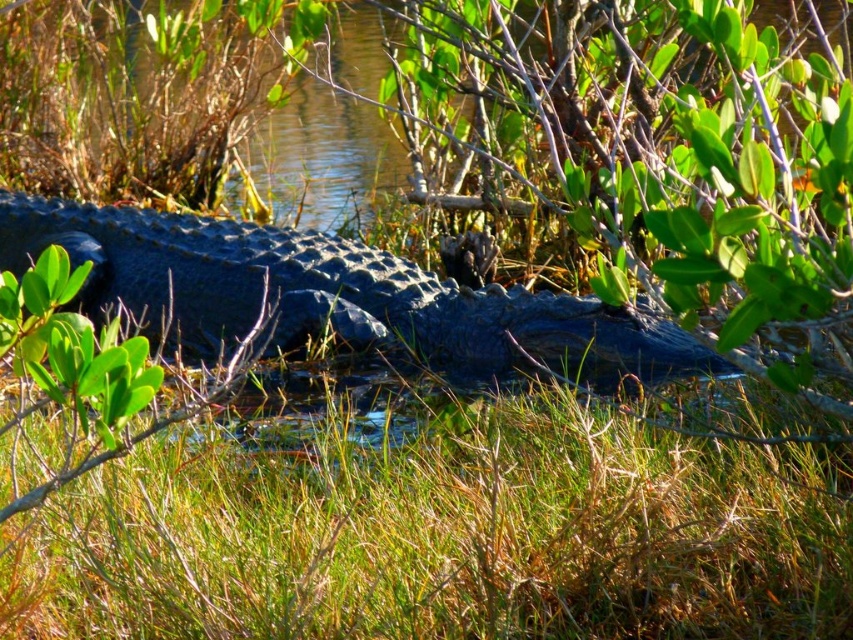
Is green grass at lower center thinner than shiny dark blue crocodile at center?

Yes, green grass at lower center is thinner than shiny dark blue crocodile at center.

Is green grass at lower center wider than shiny dark blue crocodile at center?

Incorrect, green grass at lower center's width does not surpass shiny dark blue crocodile at center's.

Between point (585, 417) and point (76, 305), which one is positioned behind?

Point (76, 305)

I want to click on green grass at lower center, so click(x=445, y=536).